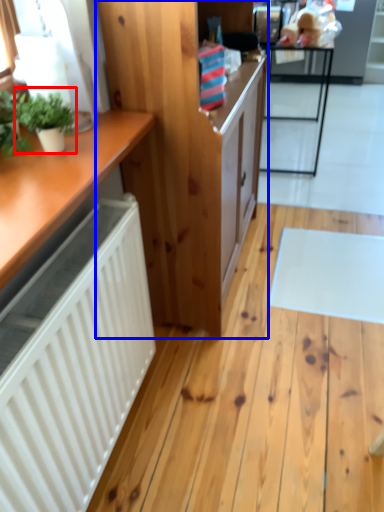
Question: Which object is further to the camera taking this photo, houseplant (highlighted by a red box) or cabinetry (highlighted by a blue box)?

Choices:
 (A) houseplant
 (B) cabinetry

Answer: (B)